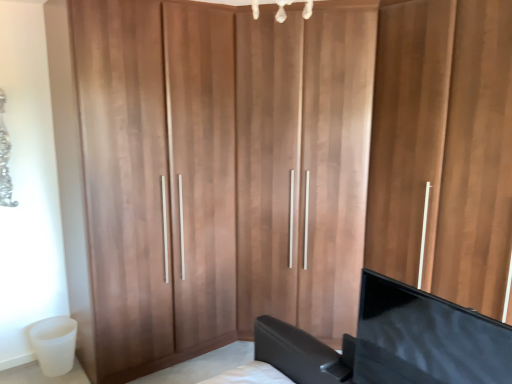
Image resolution: width=512 pixels, height=384 pixels. I want to click on wooden wardrobe at center, so click(x=443, y=148).

What do you see at coordinates (443, 148) in the screenshot? Image resolution: width=512 pixels, height=384 pixels. I see `wooden wardrobe at center` at bounding box center [443, 148].

Looking at this image, measure the distance between point (370, 254) and camera.

Point (370, 254) is 2.82 meters away from camera.

What do you see at coordinates (426, 338) in the screenshot?
I see `black glossy tv at lower right` at bounding box center [426, 338].

Looking at this image, what is the approximate height of black glossy tv at lower right?

The height of black glossy tv at lower right is 44.90 centimeters.

Identify the location of black glossy tv at lower right. This screenshot has width=512, height=384. (426, 338).

Locate an element on the screen. This screenshot has width=512, height=384. wooden wardrobe at center is located at coordinates (443, 148).

Considering the relative positions of wooden wardrobe at center and black glossy tv at lower right in the image provided, is wooden wardrobe at center to the right of black glossy tv at lower right from the viewer's perspective?

Correct, you'll find wooden wardrobe at center to the right of black glossy tv at lower right.

Is wooden wardrobe at center further to the viewer compared to black glossy tv at lower right?

Yes, wooden wardrobe at center is behind black glossy tv at lower right.

Does point (473, 306) come closer to viewer compared to point (462, 312)?

That is False.

From the image's perspective, which one is positioned lower, wooden wardrobe at center or black glossy tv at lower right?

black glossy tv at lower right, from the image's perspective.

From a real-world perspective, is wooden wardrobe at center located higher than black glossy tv at lower right?

Yes, from a real-world perspective, wooden wardrobe at center is above black glossy tv at lower right.

Which of these two, wooden wardrobe at center or black glossy tv at lower right, is wider?

wooden wardrobe at center is wider.

In terms of height, does wooden wardrobe at center look taller or shorter compared to black glossy tv at lower right?

wooden wardrobe at center is taller than black glossy tv at lower right.

Based on their sizes in the image, would you say wooden wardrobe at center is bigger or smaller than black glossy tv at lower right?

In the image, wooden wardrobe at center appears to be larger than black glossy tv at lower right.

Based on the photo, is black glossy tv at lower right a part of wooden wardrobe at center?

Actually, black glossy tv at lower right is outside wooden wardrobe at center.

Is wooden wardrobe at center touching black glossy tv at lower right?

There is a gap between wooden wardrobe at center and black glossy tv at lower right.

Is wooden wardrobe at center positioned with its back to black glossy tv at lower right?

wooden wardrobe at center is not turned away from black glossy tv at lower right.

How many degrees apart are the facing directions of wooden wardrobe at center and black glossy tv at lower right?

There is a 0.144-degree angle between the facing directions of wooden wardrobe at center and black glossy tv at lower right.

Where is `door behind the black glossy tv at lower right`? The image size is (512, 384). door behind the black glossy tv at lower right is located at coordinates (443, 148).

Considering the relative positions of black glossy tv at lower right and wooden wardrobe at center in the image provided, is black glossy tv at lower right to the right of wooden wardrobe at center from the viewer's perspective?

Incorrect, black glossy tv at lower right is not on the right side of wooden wardrobe at center.

Consider the image. Is black glossy tv at lower right further to camera compared to wooden wardrobe at center?

That is False.

Is point (490, 337) farther from viewer compared to point (471, 140)?

That is False.

From the image's perspective, which object appears higher, black glossy tv at lower right or wooden wardrobe at center?

From the image's view, wooden wardrobe at center is above.

From a real-world perspective, who is located lower, black glossy tv at lower right or wooden wardrobe at center?

In real-world perspective, black glossy tv at lower right is lower.

Considering the sizes of black glossy tv at lower right and wooden wardrobe at center in the image, is black glossy tv at lower right wider or thinner than wooden wardrobe at center?

Considering their sizes, black glossy tv at lower right looks slimmer than wooden wardrobe at center.

Does black glossy tv at lower right have a greater height compared to wooden wardrobe at center?

In fact, black glossy tv at lower right may be shorter than wooden wardrobe at center.

Considering the relative sizes of black glossy tv at lower right and wooden wardrobe at center in the image provided, is black glossy tv at lower right smaller than wooden wardrobe at center?

Indeed, black glossy tv at lower right has a smaller size compared to wooden wardrobe at center.

Is wooden wardrobe at center completely or partially inside black glossy tv at lower right?

No, wooden wardrobe at center is located outside of black glossy tv at lower right.

Is black glossy tv at lower right next to wooden wardrobe at center?

black glossy tv at lower right is not next to wooden wardrobe at center, and they're not touching.

Is black glossy tv at lower right positioned with its back to wooden wardrobe at center?

Yes.

The width and height of the screenshot is (512, 384). What are the coordinates of `door positioned vertically above the black glossy tv at lower right (from a real-world perspective)` in the screenshot? It's located at (443, 148).

What are the coordinates of `flat in front of the wooden wardrobe at center` in the screenshot? It's located at (426, 338).

What are the coordinates of `flat that is on the left side of wooden wardrobe at center` in the screenshot? It's located at [x=426, y=338].